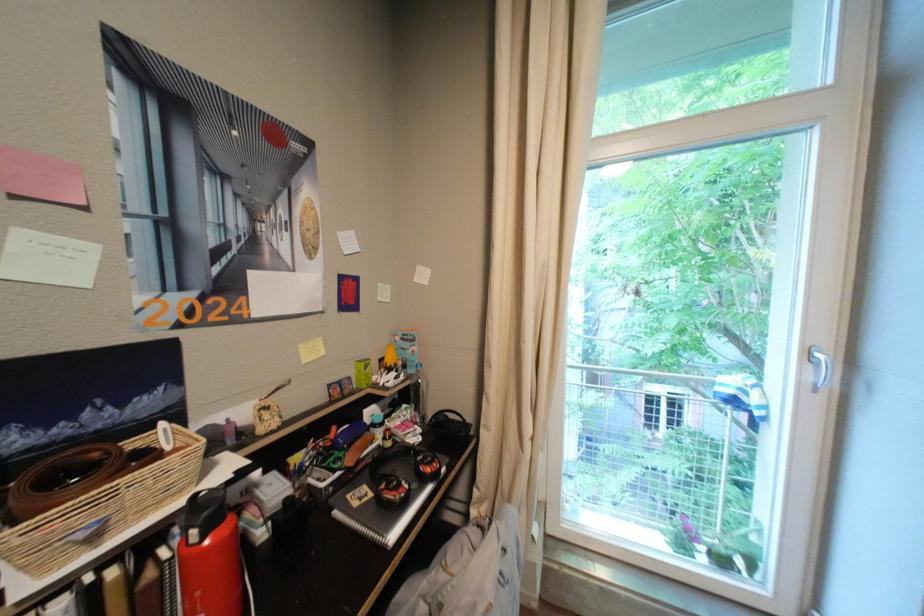
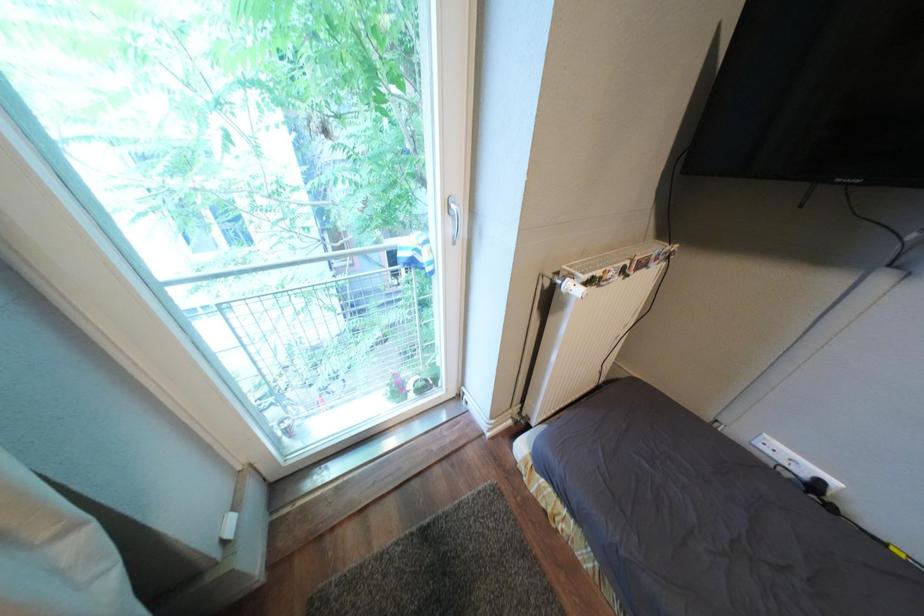
How did the camera likely rotate?

The camera rotated toward right-down.